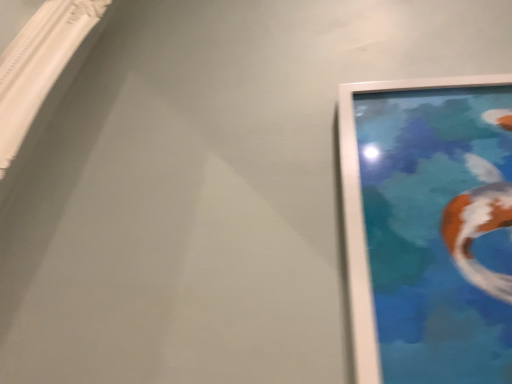
Describe the element at coordinates (429, 228) in the screenshot. The height and width of the screenshot is (384, 512). I see `white glossy picture frame at upper right` at that location.

I want to click on white glossy picture frame at upper right, so click(x=429, y=228).

You are a GUI agent. You are given a task and a screenshot of the screen. Output one action in this format:
    pyautogui.click(x=<x>, y=<y>)
    Task: Click on the white glossy picture frame at upper right
    This screenshot has width=512, height=384.
    Given the screenshot: What is the action you would take?
    pyautogui.click(x=429, y=228)